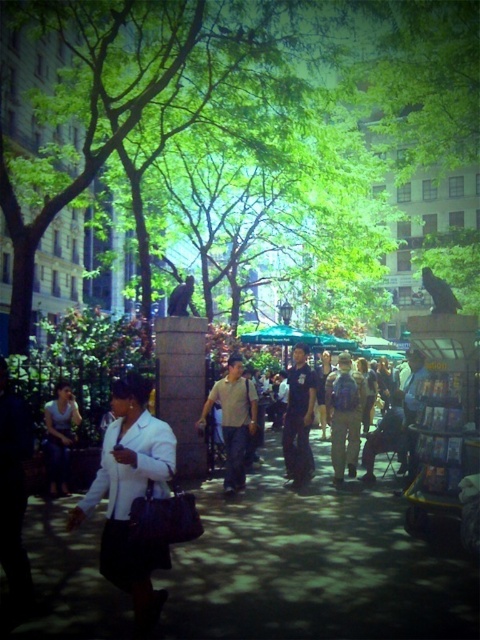
You are a photographer aiming to capture the dark blue backpack at center and the dark blue uniform at center in your shot. Since both items are dark blue, how can you distinguish them in the photo?

The dark blue backpack at center is positioned under the dark blue uniform at center, so the backpack will appear below the uniform in the photo.

In the scene shown: You are a photographer trying to capture a candid shot of the light brown fabric shirt at center and dark blue backpack at center. To ensure both are in focus, you need to know which object is wider. Which one is wider?

The light brown fabric shirt at center is wider than the dark blue backpack at center according to the description.

You are a photographer positioned at the park entrance. You want to take a photo that includes both the white matte blazer at center and the dark blue uniform at center. Which object should you adjust your focus to ensure both are visible in the frame?

The white matte blazer at center is in front of the dark blue uniform at center. To ensure both are visible in the frame, adjust your focus to include both by considering the depth of field so that both foreground and background elements are sharp.